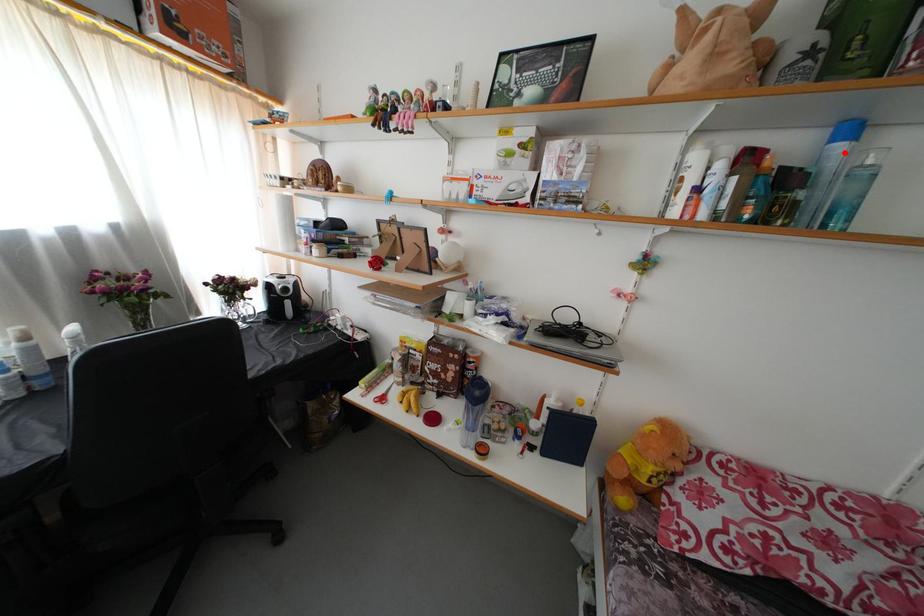
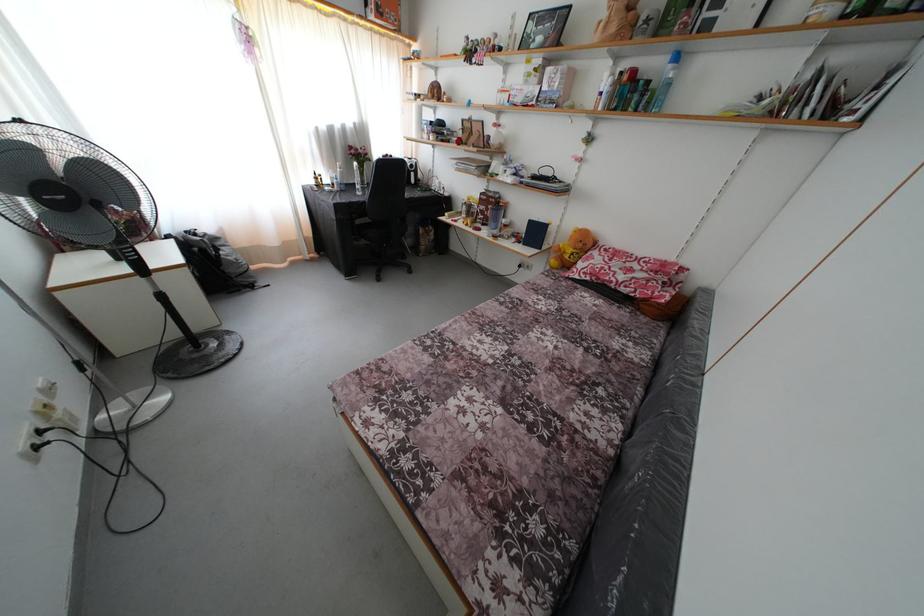
Where in the second image is the point corresponding to the highlighted location from the first image?

(675, 73)